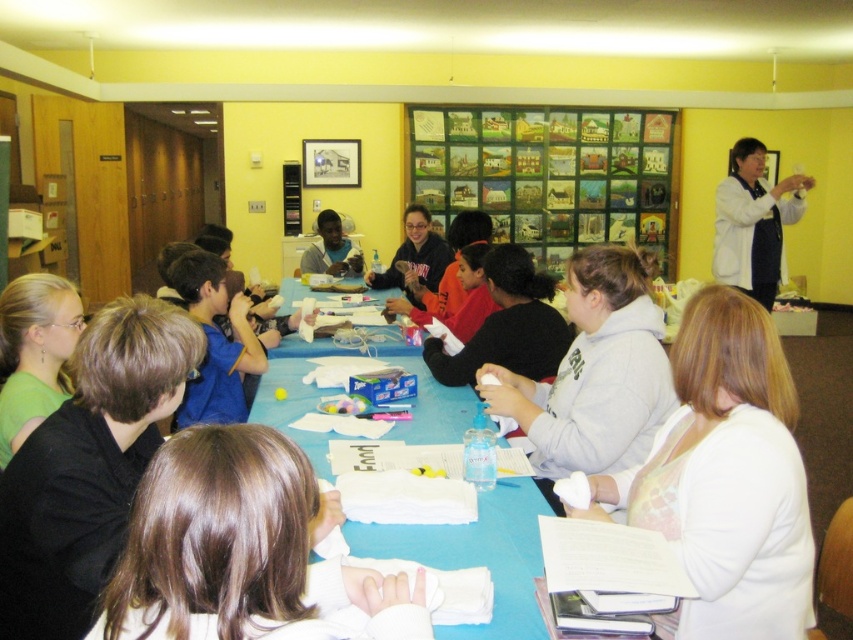
What do you see at coordinates (550, 173) in the screenshot? I see `wooden framed paintings at upper center` at bounding box center [550, 173].

Is point (514, 177) closer to camera compared to point (526, 534)?

No, (514, 177) is further to viewer.

Between point (576, 156) and point (503, 634), which one is positioned behind?

Point (576, 156)

Locate an element on the screen. wooden framed paintings at upper center is located at coordinates (550, 173).

In the scene shown: Measure the distance from white matte shirt at lower right to matte black shirt at center.

white matte shirt at lower right is 4.29 meters away from matte black shirt at center.

Does white matte shirt at lower right appear on the left side of matte black shirt at center?

In fact, white matte shirt at lower right is to the right of matte black shirt at center.

Image resolution: width=853 pixels, height=640 pixels. What do you see at coordinates (726, 477) in the screenshot? I see `white matte shirt at lower right` at bounding box center [726, 477].

You are a GUI agent. You are given a task and a screenshot of the screen. Output one action in this format:
    pyautogui.click(x=<x>, y=<y>)
    Task: Click on the white matte shirt at lower right
    Image resolution: width=853 pixels, height=640 pixels.
    Given the screenshot: What is the action you would take?
    pyautogui.click(x=726, y=477)

Between point (260, 385) and point (318, 220), which one is positioned behind?

The point (318, 220) is behind.

Which is above, blue paper at center or matte black shirt at center?

matte black shirt at center

Consider the image. Who is more distant from viewer, (514, 477) or (338, 224)?

Positioned behind is point (338, 224).

Find the location of a particular element. This screenshot has width=853, height=640. blue paper at center is located at coordinates (476, 554).